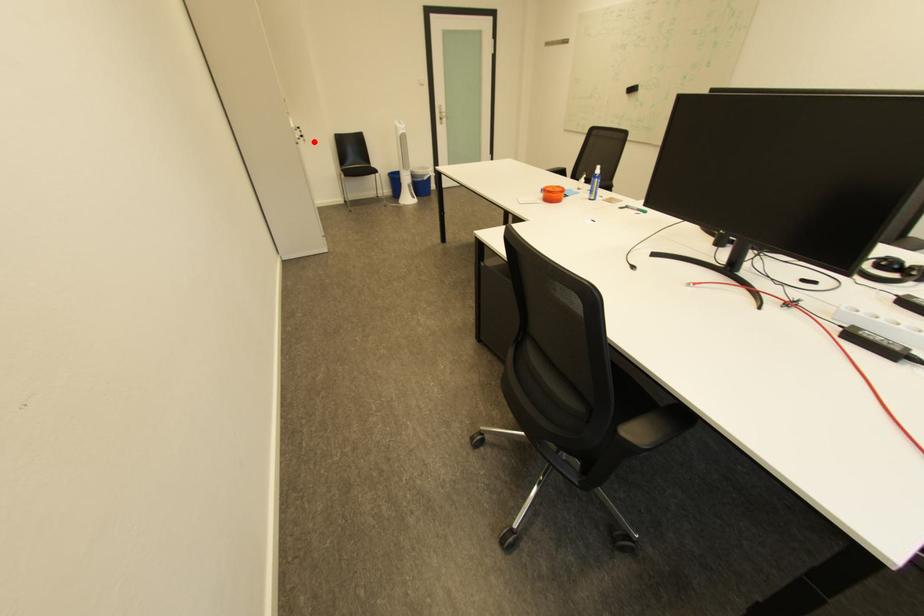
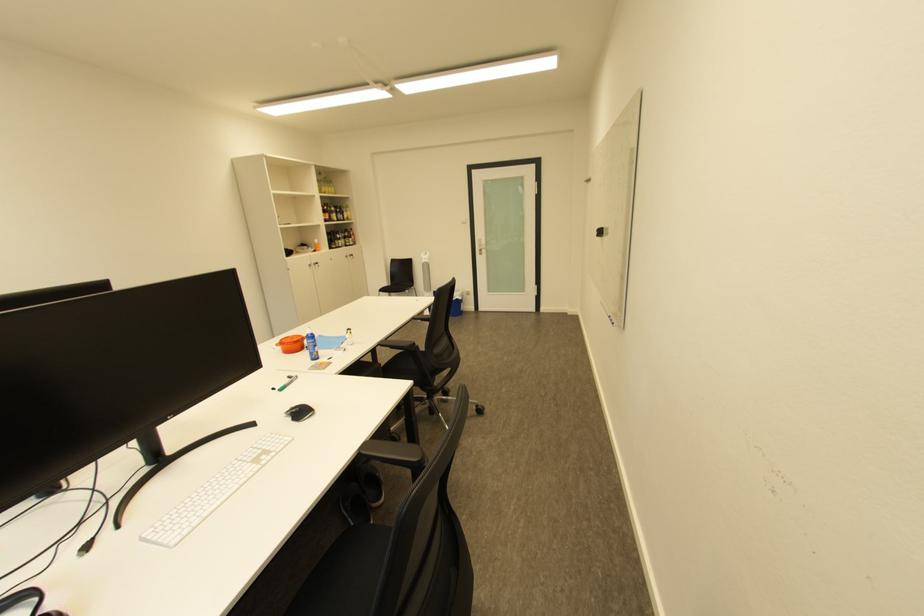
Find the pixel in the second image that matches the highlighted location in the first image.

(329, 267)